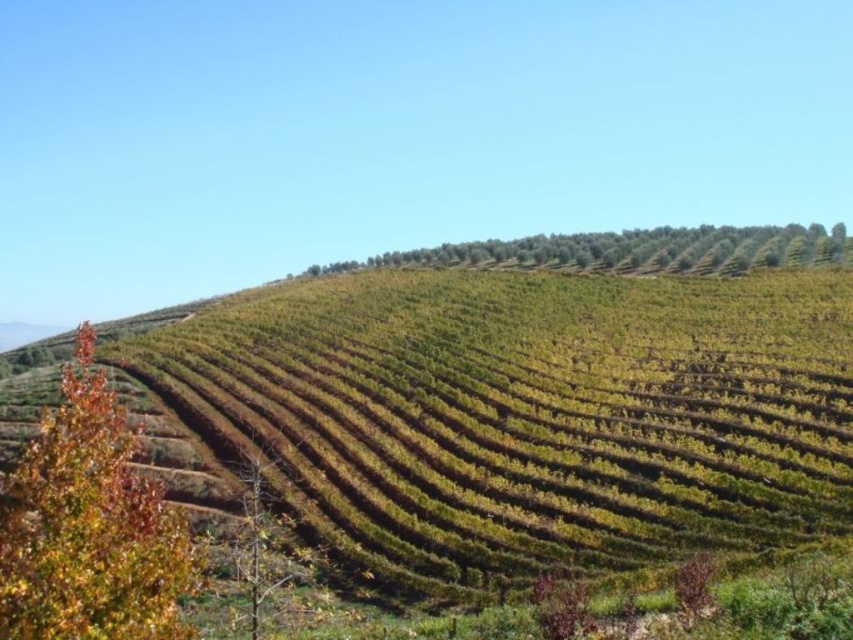
Question: Estimate the real-world distances between objects in this image. Which object is farther from the brown leafless tree at lower left?

Choices:
 (A) multicolored foliage at left
 (B) green leafy trees at upper center

Answer: (B)

Question: From the image, what is the correct spatial relationship of multicolored foliage at left in relation to brown leafless tree at lower left?

Choices:
 (A) right
 (B) left

Answer: (B)

Question: Can you confirm if multicolored foliage at left is wider than green leafy trees at upper center?

Choices:
 (A) yes
 (B) no

Answer: (B)

Question: Based on their relative distances, which object is farther from the multicolored foliage at left?

Choices:
 (A) brown leafless tree at lower left
 (B) green leafy trees at upper center

Answer: (B)

Question: Can you confirm if multicolored foliage at left is bigger than green leafy trees at upper center?

Choices:
 (A) no
 (B) yes

Answer: (A)

Question: Which is farther from the brown leafless tree at lower left?

Choices:
 (A) multicolored foliage at left
 (B) green leafy trees at upper center

Answer: (B)